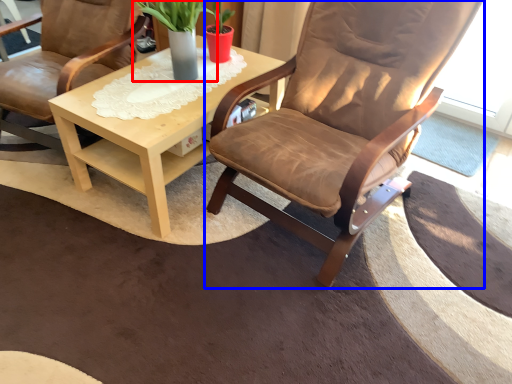
Question: Which object appears closest to the camera in this image, houseplant (highlighted by a red box) or chair (highlighted by a blue box)?

Choices:
 (A) houseplant
 (B) chair

Answer: (B)